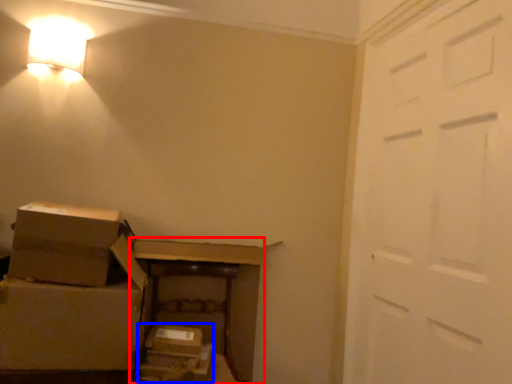
Question: Which point is closer to the camera, furniture (highlighted by a red box) or storage box (highlighted by a blue box)?

Choices:
 (A) furniture
 (B) storage box

Answer: (A)